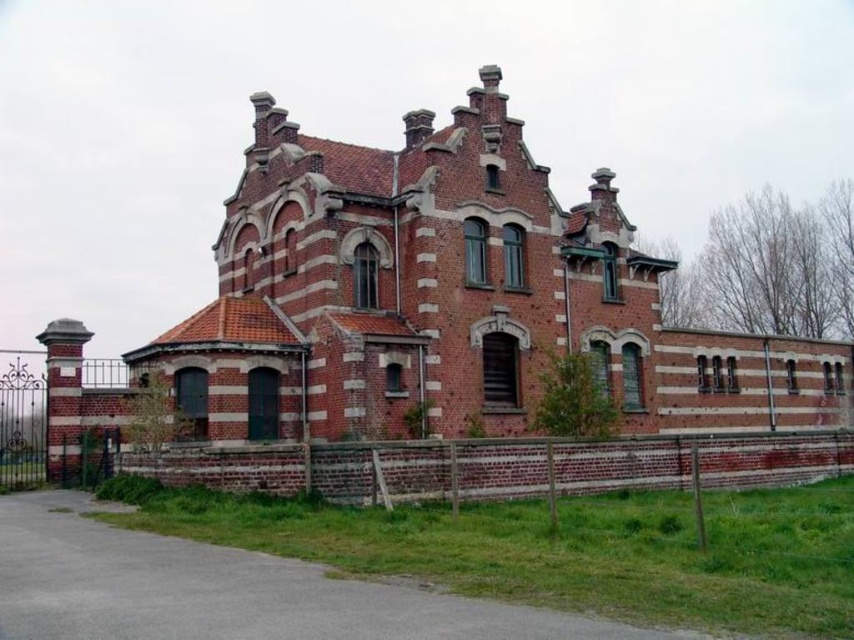
You are standing in front of the historic brick building and want to enter through the black wrought iron gate at left. However, you notice the brown brick wall at lower center blocking your path. Can you walk around the wall to reach the gate?

The brown brick wall at lower center is in front of the black wrought iron gate at left, so you can walk around the wall to reach the gate since it is blocking your path but not necessarily enclosing it.